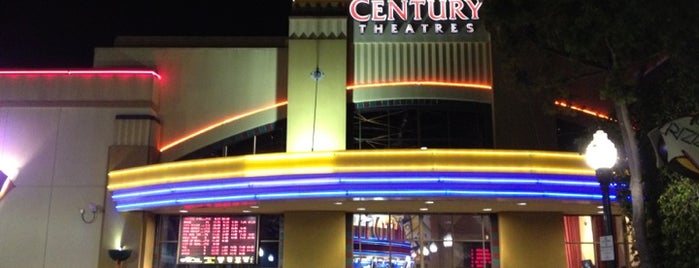
Locate an element on the screen. red neon light is located at coordinates click(x=122, y=67).